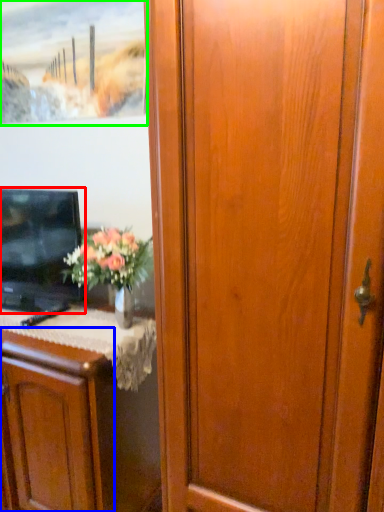
Question: Which object is the farthest from television (highlighted by a red box)? Choose among these: cabinetry (highlighted by a blue box) or picture frame (highlighted by a green box).

Choices:
 (A) cabinetry
 (B) picture frame

Answer: (B)